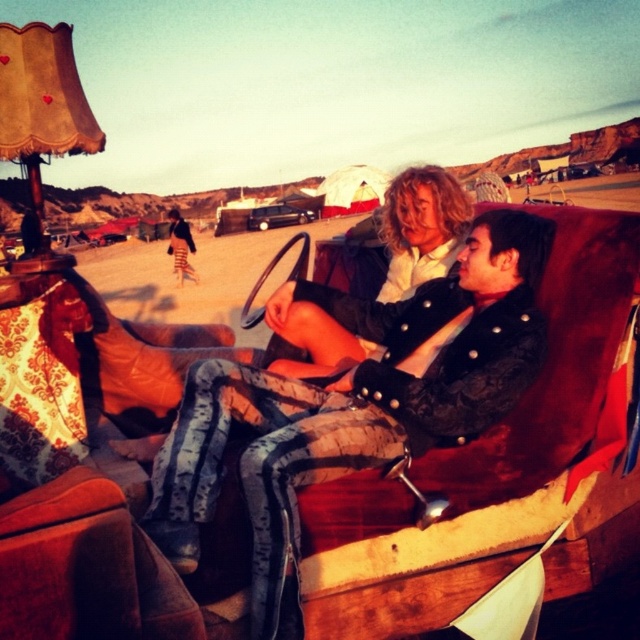
Question: Is the position of black leather jacket at center less distant than that of blonde hair at center?

Choices:
 (A) no
 (B) yes

Answer: (B)

Question: From the image, what is the correct spatial relationship of black leather jacket at center in relation to blonde hair at center?

Choices:
 (A) right
 (B) left

Answer: (B)

Question: Is black leather jacket at center closer to the viewer compared to blonde hair at center?

Choices:
 (A) yes
 (B) no

Answer: (A)

Question: Which object is farther from the camera taking this photo?

Choices:
 (A) blonde hair at center
 (B) black leather jacket at center

Answer: (A)

Question: Among these objects, which one is nearest to the camera?

Choices:
 (A) blonde hair at center
 (B) black leather jacket at center

Answer: (B)